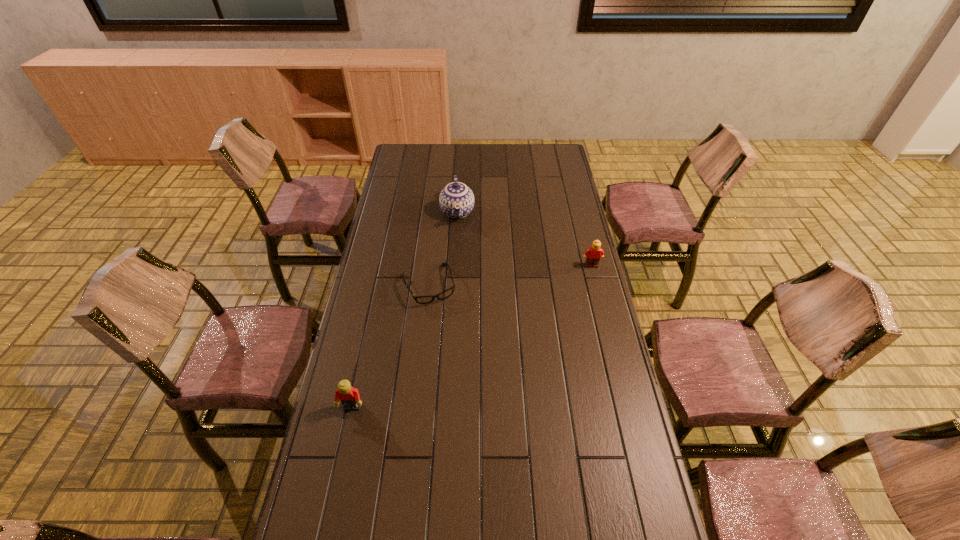
Where is `the nearer Lego`? This screenshot has height=540, width=960. the nearer Lego is located at coordinates (349, 396).

Locate an element on the screen. The height and width of the screenshot is (540, 960). the left Lego is located at coordinates (349, 396).

Find the location of a particular element. This screenshot has height=540, width=960. the right Lego is located at coordinates (594, 253).

In order to click on the farther Lego in this screenshot , I will do `click(594, 253)`.

Where is `the shortest object`? The height and width of the screenshot is (540, 960). the shortest object is located at coordinates (447, 293).

At what (x,y) coordinates should I click in order to perform the action: click on the tallest object. Please return your answer as a coordinate pair (x, y). Looking at the image, I should click on (456, 200).

The width and height of the screenshot is (960, 540). What are the coordinates of `chinaware` in the screenshot? It's located at (456, 200).

You are a GUI agent. You are given a task and a screenshot of the screen. Output one action in this format:
    pyautogui.click(x=<x>, y=<y>)
    Task: Click on the free space located 0.300m on the face of the nearest object
    Image resolution: width=960 pixels, height=540 pixels.
    Given the screenshot: What is the action you would take?
    tap(326, 525)

You are a GUI agent. You are given a task and a screenshot of the screen. Output one action in this format:
    pyautogui.click(x=<x>, y=<y>)
    Task: Click on the free spot located 0.140m on the face of the farther Lego
    This screenshot has height=540, width=960.
    Given the screenshot: What is the action you would take?
    pyautogui.click(x=599, y=294)

You are a GUI agent. You are given a task and a screenshot of the screen. Output one action in this format:
    pyautogui.click(x=<x>, y=<y>)
    Task: Click on the vacant area situated 0.270m on the front-facing side of the spectacles
    
    Given the screenshot: What is the action you would take?
    (459, 364)